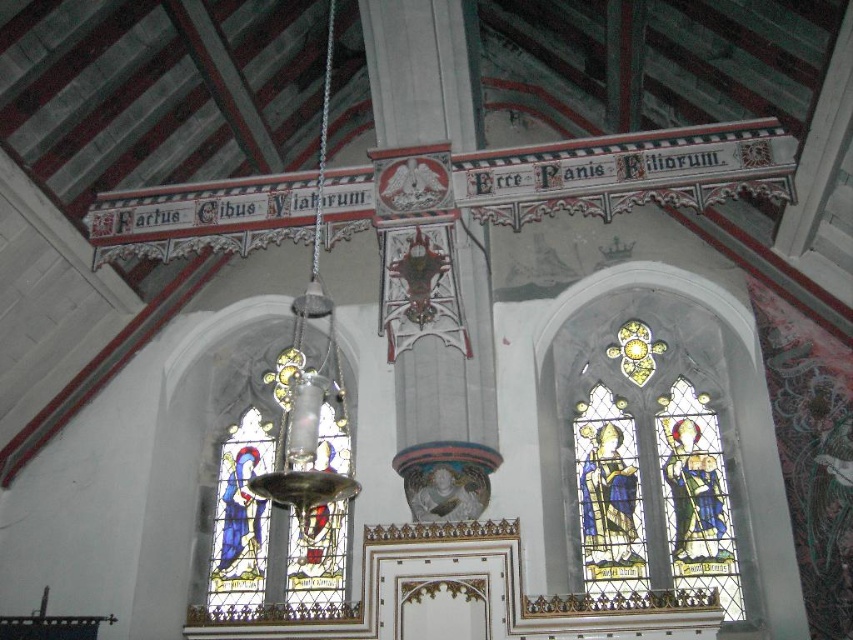
You are standing in the church and want to take a photo of the stained glass windows. You notice two points marked as point (680,429) and point (341,392). Which point is closer to you when facing the windows?

Point (680,429) is in front of point (341,392), so it is closer to you when facing the windows.

You are standing at the entrance of the church and want to take a photo of both the stained glass window at right and the stained glass window at center. If your camera has a maximum focus range of 25 meters, will you be able to capture both windows in one shot without moving?

The stained glass window at right is 25.13 meters away from the stained glass window at center. Since the distance between them exceeds the camera maximum focus range of 25 meters, you won not be able to capture both windows in one shot without moving.

You are standing in the church and want to take a photo of the stained glass window at right without including the inscriptions above it. Which direction should you move to ensure the window is in the frame while avoiding the inscriptions?

Move to the right side of the church so that the stained glass window at right is centered in your view while the inscriptions above it are out of frame.